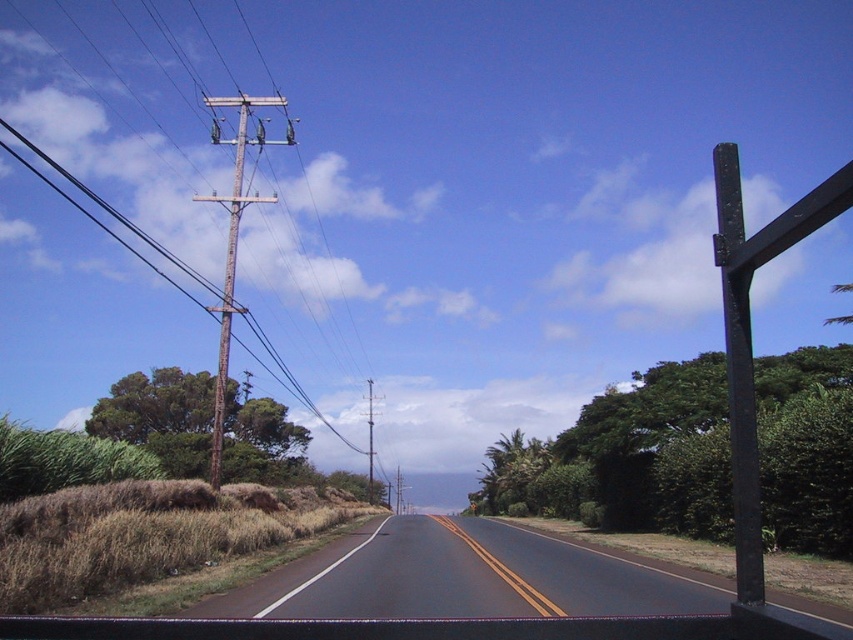
Can you confirm if green leafy tree at right is positioned to the left of black asphalt road at center?

Incorrect, green leafy tree at right is not on the left side of black asphalt road at center.

Locate an element on the screen. The width and height of the screenshot is (853, 640). green leafy tree at right is located at coordinates (631, 456).

Find the location of a particular element. green leafy tree at right is located at coordinates (631, 456).

Does rusty wood pole at left appear on the left side of green leafy tree at right?

Yes, rusty wood pole at left is to the left of green leafy tree at right.

Who is more forward, (3,397) or (648,472)?

Point (648,472) is more forward.

The image size is (853, 640). Describe the element at coordinates (158, 211) in the screenshot. I see `rusty wood pole at left` at that location.

Identify the location of rusty wood pole at left. This screenshot has height=640, width=853. click(x=158, y=211).

Who is positioned more to the left, rusty wood pole at left or black asphalt road at center?

rusty wood pole at left

Does rusty wood pole at left come in front of black asphalt road at center?

No.

The image size is (853, 640). In order to click on rusty wood pole at left in this screenshot , I will do `click(158, 211)`.

Locate an element on the screen. rusty wood pole at left is located at coordinates (158, 211).